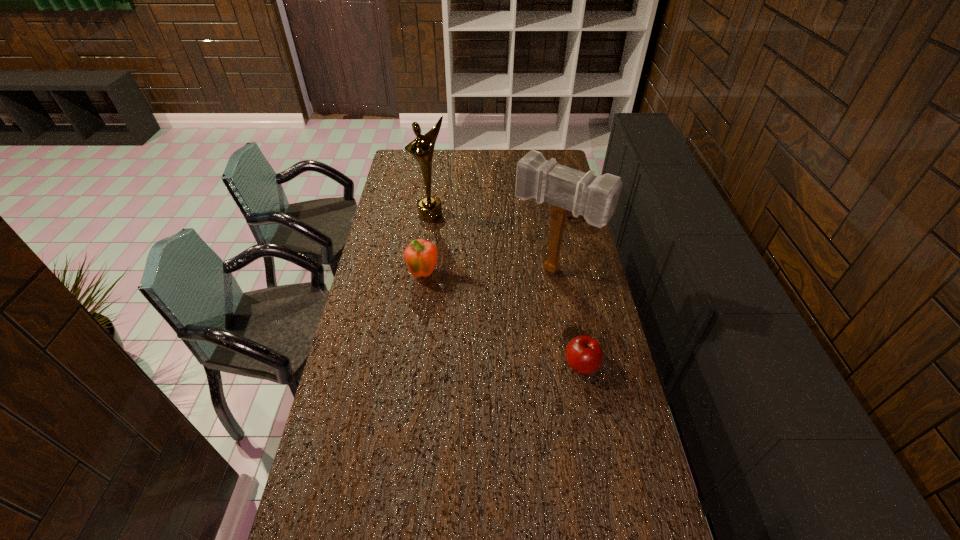
Where is `free location located on the side with the handle of the fourth tallest object`? The image size is (960, 540). free location located on the side with the handle of the fourth tallest object is located at coordinates (553, 232).

The width and height of the screenshot is (960, 540). In order to click on free space located on the front-facing side of the award in this screenshot , I will do `click(457, 256)`.

This screenshot has height=540, width=960. I want to click on free space located on the front-facing side of the award, so pos(448,242).

You are a GUI agent. You are given a task and a screenshot of the screen. Output one action in this format:
    pyautogui.click(x=<x>, y=<y>)
    Task: Click on the free space located 0.290m on the front-facing side of the award
    This screenshot has width=960, height=540.
    Given the screenshot: What is the action you would take?
    pyautogui.click(x=460, y=263)

The image size is (960, 540). Find the location of `free space located 0.320m at the head of the mallet`. free space located 0.320m at the head of the mallet is located at coordinates (488, 347).

Where is `blank space located at the head of the mallet`? blank space located at the head of the mallet is located at coordinates (479, 357).

At what (x,y) coordinates should I click in order to perform the action: click on free region located 0.150m at the head of the mallet. Please return your answer as a coordinate pair (x, y). Looking at the image, I should click on (513, 315).

I want to click on object located at the left edge, so click(x=421, y=148).

Where is `apple present at the right edge`? The width and height of the screenshot is (960, 540). apple present at the right edge is located at coordinates (584, 355).

Image resolution: width=960 pixels, height=540 pixels. In order to click on cup that is at the right edge in this screenshot , I will do `click(570, 214)`.